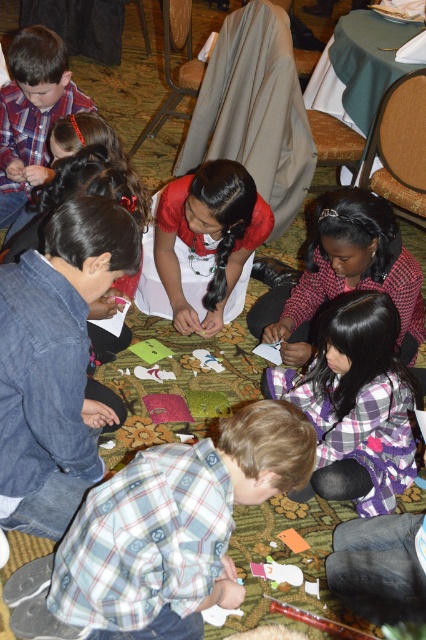
Question: Estimate the real-world distances between objects in this image. Which object is closer to the purple plaid shirt at lower center?

Choices:
 (A) matte plaid shirt at upper left
 (B) matte red shirt at center

Answer: (B)

Question: Is purple plaid shirt at lower center below matte plaid shirt at upper left?

Choices:
 (A) yes
 (B) no

Answer: (A)

Question: Which point appears farthest from the camera in this image?

Choices:
 (A) (46, 177)
 (B) (210, 243)
 (C) (409, 426)
 (D) (377, 216)

Answer: (A)

Question: Is purple plaid shirt at lower center bigger than matte red shirt at center?

Choices:
 (A) yes
 (B) no

Answer: (B)

Question: Among these points, which one is nearest to the camera?

Choices:
 (A) (345, 349)
 (B) (313, 250)

Answer: (A)

Question: Is purple plaid shirt at lower center to the right of matte red blouse at center from the viewer's perspective?

Choices:
 (A) yes
 (B) no

Answer: (A)